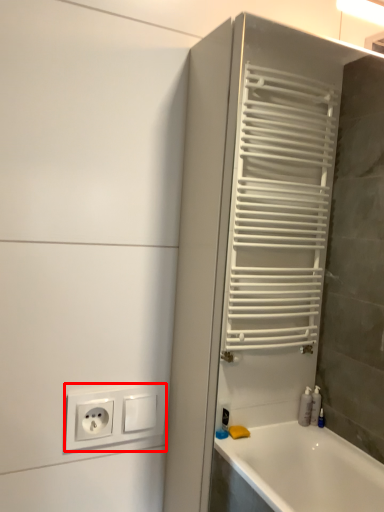
Question: From the image's perspective, where is power plugs and sockets (annotated by the red box) located in relation to screen door in the image?

Choices:
 (A) above
 (B) below

Answer: (B)